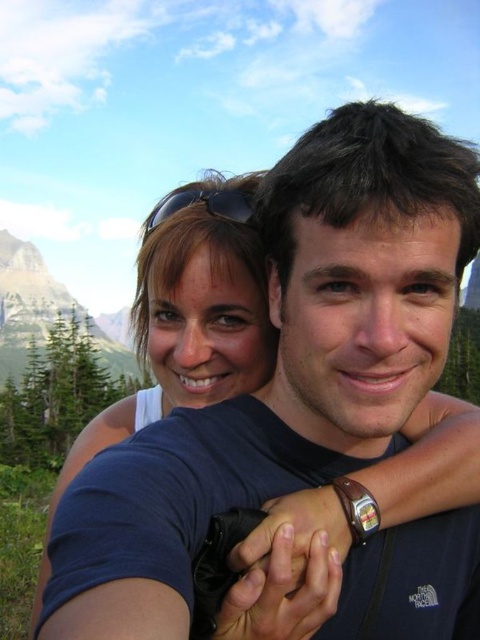
Question: Can you confirm if matte white shirt at upper center is positioned to the left of black matte sunglasses at upper center?

Choices:
 (A) yes
 (B) no

Answer: (A)

Question: Which point is farther to the camera?

Choices:
 (A) (205, 202)
 (B) (21, 276)
 (C) (250, 268)

Answer: (B)

Question: Which object appears closest to the camera in this image?

Choices:
 (A) matte white shirt at upper center
 (B) green forested mountain at upper left

Answer: (A)

Question: Is matte white shirt at upper center below green forested mountain at upper left?

Choices:
 (A) no
 (B) yes

Answer: (B)

Question: Is matte white shirt at upper center bigger than black matte sunglasses at upper center?

Choices:
 (A) no
 (B) yes

Answer: (B)

Question: Which object appears farthest from the camera in this image?

Choices:
 (A) black matte sunglasses at upper center
 (B) green forested mountain at upper left
 (C) matte white shirt at upper center

Answer: (B)